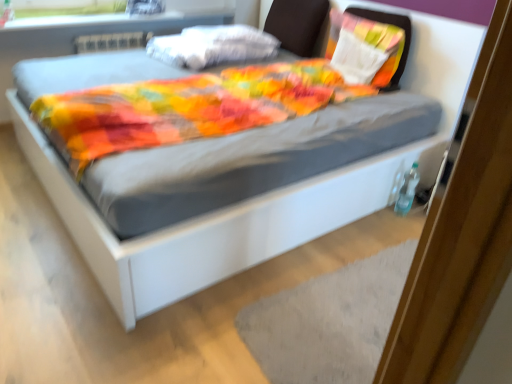
This screenshot has height=384, width=512. I want to click on free space to the left of gray textured mat at lower center, so click(202, 314).